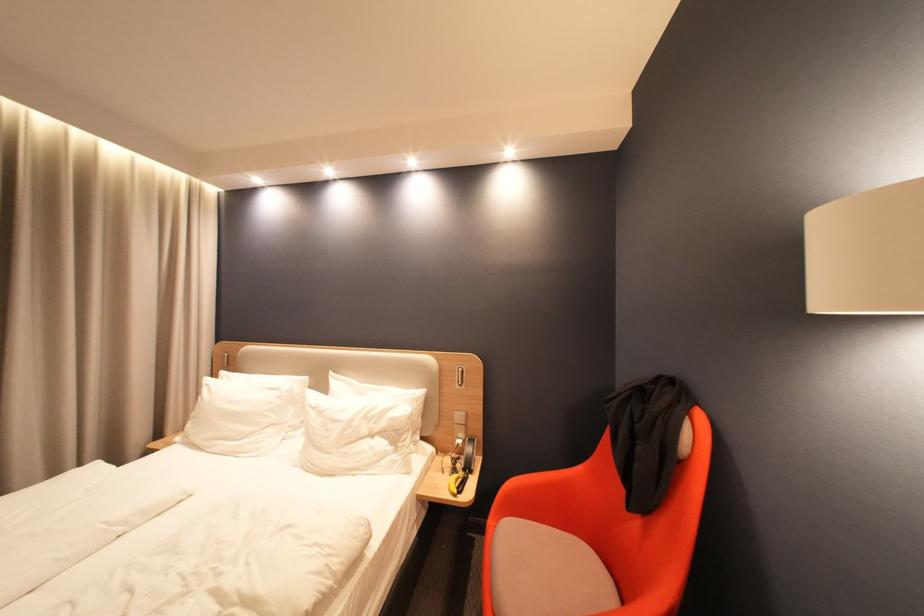
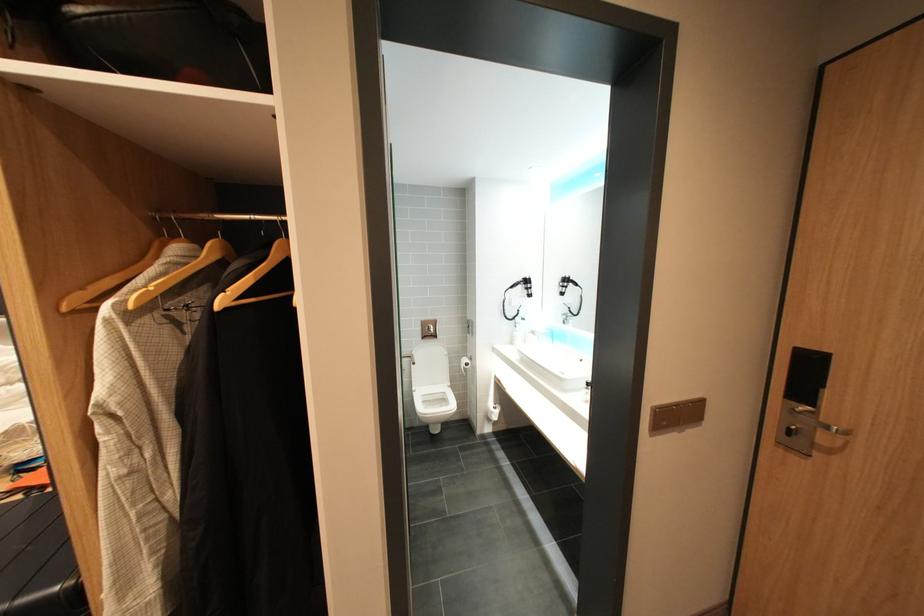
In a continuous first-person perspective shot, in which direction is the camera moving?

The cameraman walked toward right, backward.